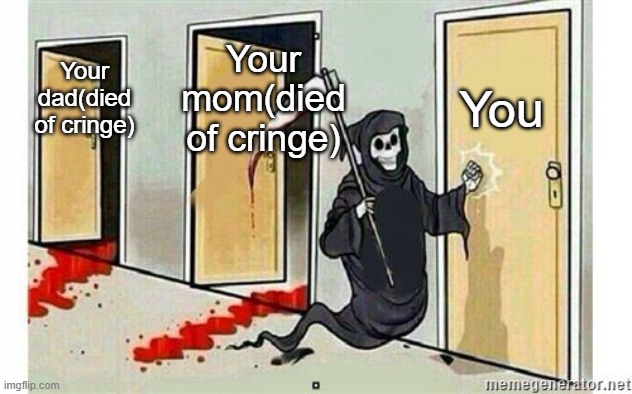
Identify the location of floor. (246, 377).